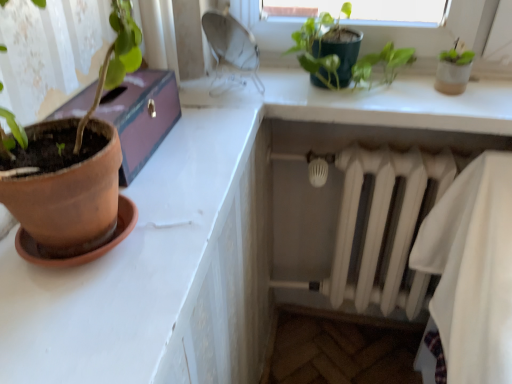
I want to click on terracotta clay pot at left, so click(x=141, y=116).

What is the approximate height of green matte plant at upper center?

It is 7.76 inches.

Locate an element on the screen. This screenshot has height=384, width=512. white matte radiator at lower right is located at coordinates (385, 227).

From a real-world perspective, is terracotta clay pot at left on top of terracotta clay pot at left?

Incorrect, from a real-world perspective, terracotta clay pot at left is lower than terracotta clay pot at left.

Considering the relative sizes of terracotta clay pot at left and terracotta clay pot at left in the image provided, is terracotta clay pot at left smaller than terracotta clay pot at left?

No.

Is terracotta clay pot at left located within terracotta clay pot at left?

No, terracotta clay pot at left is not surrounded by terracotta clay pot at left.

Considering the points (184, 134) and (140, 110), which point is in front, point (184, 134) or point (140, 110)?

Positioned in front is point (140, 110).

From a real-world perspective, between terracotta clay pot at left and terracotta clay pot at left, who is vertically higher?

From a 3D spatial view, terracotta clay pot at left is above.

Based on the photo, is terracotta clay pot at left facing towards terracotta clay pot at left?

No, terracotta clay pot at left is not aimed at terracotta clay pot at left.

Considering the sizes of objects terracotta clay pot at left and terracotta clay pot at left in the image provided, who is smaller, terracotta clay pot at left or terracotta clay pot at left?

Smaller between the two is terracotta clay pot at left.

Consider the image. Is terracotta clay pot at left next to terracotta clay pot at left?

No.

From the image's perspective, is green matte plant at upper center positioned above or below terracotta clay pot at left?

green matte plant at upper center is situated higher than terracotta clay pot at left in the image.

From a real-world perspective, is green matte plant at upper center beneath terracotta clay pot at left?

No, from a real-world perspective, green matte plant at upper center is not under terracotta clay pot at left.

Is green matte plant at upper center closer to the viewer compared to terracotta clay pot at left?

No, green matte plant at upper center is further to the viewer.

Is green matte plant at upper center not within terracotta clay pot at left?

That's correct, green matte plant at upper center is outside of terracotta clay pot at left.

Consider the image. Is terracotta clay pot at left beside white matte radiator at lower right?

No, terracotta clay pot at left is not in contact with white matte radiator at lower right.

From the image's perspective, is terracotta clay pot at left located above or below white matte radiator at lower right?

Based on their image positions, terracotta clay pot at left is located above white matte radiator at lower right.

Can you tell me how much terracotta clay pot at left and white matte radiator at lower right differ in facing direction?

The angular difference between terracotta clay pot at left and white matte radiator at lower right is 0.381 degrees.

Considering the relative sizes of white matte radiator at lower right and green matte plant at upper center in the image provided, is white matte radiator at lower right wider than green matte plant at upper center?

Incorrect, the width of white matte radiator at lower right does not surpass that of green matte plant at upper center.

Is point (395, 210) less distant than point (395, 70)?

That is False.

Is white matte radiator at lower right taller or shorter than green matte plant at upper center?

white matte radiator at lower right is taller than green matte plant at upper center.

From a real-world perspective, relative to green matte plant at upper center, is white matte radiator at lower right vertically above or below?

In terms of real-world spatial position, white matte radiator at lower right is below green matte plant at upper center.

Is green matte plant at upper center not near terracotta clay pot at left?

No.

From the image's perspective, between green matte plant at upper center and terracotta clay pot at left, which one is located above?

green matte plant at upper center, from the image's perspective.

Which of these two, green matte plant at upper center or terracotta clay pot at left, stands shorter?

terracotta clay pot at left.

Which of these two, green matte plant at upper center or terracotta clay pot at left, is thinner?

green matte plant at upper center is thinner.

Is white matte radiator at lower right facing away from terracotta clay pot at left?

No, white matte radiator at lower right is not facing the opposite direction of terracotta clay pot at left.

From their relative heights in the image, would you say white matte radiator at lower right is taller or shorter than terracotta clay pot at left?

In the image, white matte radiator at lower right appears to be taller than terracotta clay pot at left.

From a real-world perspective, which object rests below the other?

In real-world perspective, white matte radiator at lower right is lower.

How much distance is there between white matte radiator at lower right and terracotta clay pot at left?

white matte radiator at lower right is 57.45 centimeters away from terracotta clay pot at left.

Identify the location of counter top that is in front of the terracotta clay pot at left. Image resolution: width=512 pixels, height=384 pixels. (150, 274).

In order to click on counter top to the right of terracotta clay pot at left in this screenshot , I will do `click(150, 274)`.

Based on their spatial positions, is green matte plant at upper center or terracotta clay pot at left closer to terracotta clay pot at left?

Based on the image, terracotta clay pot at left appears to be nearer to terracotta clay pot at left.

From the image, which object appears to be farther from terracotta clay pot at left, terracotta clay pot at left or green matte plant at upper center?

Among the two, green matte plant at upper center is located further to terracotta clay pot at left.

Which object lies further to the anchor point green matte plant at upper center, terracotta clay pot at left or terracotta clay pot at left?

terracotta clay pot at left lies further to green matte plant at upper center than the other object.

Looking at the image, which one is located further to white matte radiator at lower right, terracotta clay pot at left or terracotta clay pot at left?

Among the two, terracotta clay pot at left is located further to white matte radiator at lower right.

When comparing their distances from white matte radiator at lower right, does green matte plant at upper center or terracotta clay pot at left seem closer?

Among the two, green matte plant at upper center is located nearer to white matte radiator at lower right.

Considering their positions, is green matte plant at upper center positioned closer to terracotta clay pot at left than white matte radiator at lower right?

green matte plant at upper center.

Consider the image. Based on their spatial positions, is terracotta clay pot at left or white matte radiator at lower right closer to terracotta clay pot at left?

The object closer to terracotta clay pot at left is terracotta clay pot at left.

Considering their positions, is white matte radiator at lower right positioned closer to terracotta clay pot at left than green matte plant at upper center?

green matte plant at upper center is positioned closer to the anchor terracotta clay pot at left.

This screenshot has width=512, height=384. Identify the location of houseplant positioned between terracotta clay pot at left and white matte radiator at lower right from near to far. (323, 46).

Locate an element on the screen. Image resolution: width=512 pixels, height=384 pixels. counter top situated between terracotta clay pot at left and green matte plant at upper center from left to right is located at coordinates (150, 274).

You are a GUI agent. You are given a task and a screenshot of the screen. Output one action in this format:
    pyautogui.click(x=<x>, y=<y>)
    Task: Click on the counter top located between terracotta clay pot at left and white matte radiator at lower right in the left-right direction
    Image resolution: width=512 pixels, height=384 pixels.
    Given the screenshot: What is the action you would take?
    pyautogui.click(x=150, y=274)

Identify the location of houseplant located between terracotta clay pot at left and white matte radiator at lower right in the left-right direction. pos(323,46).